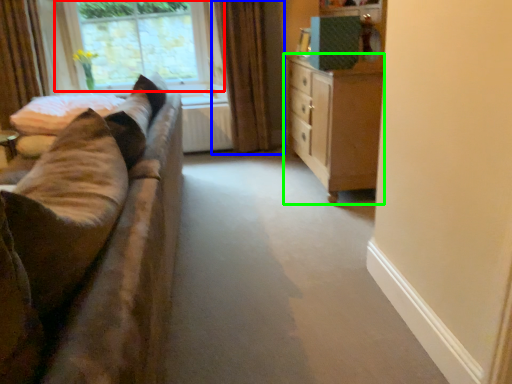
Question: Estimate the real-world distances between objects in this image. Which object is closer to window (highlighted by a red box), curtain (highlighted by a blue box) or chest of drawers (highlighted by a green box)?

Choices:
 (A) curtain
 (B) chest of drawers

Answer: (A)